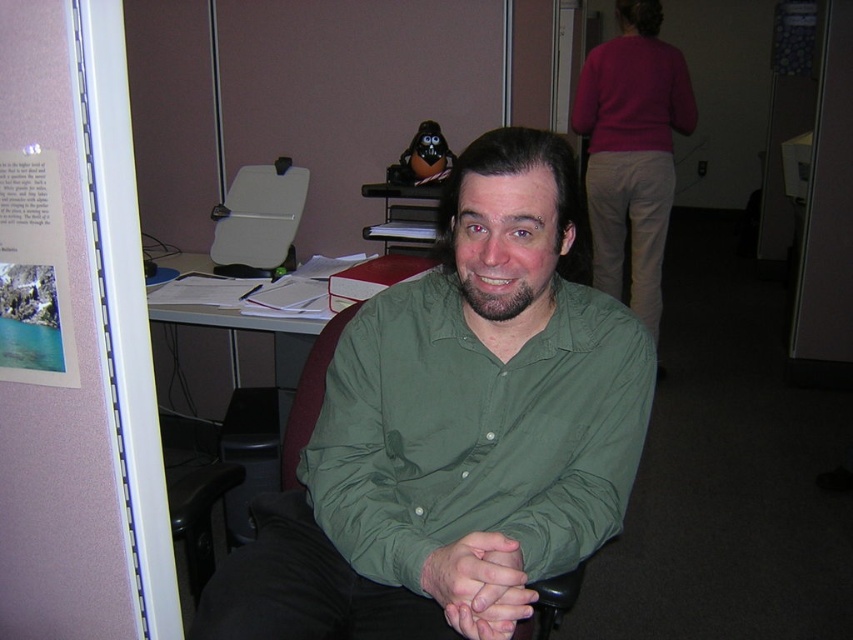
You are an office worker who needs to place a new document organizer on your desk. You have two items on your desk labeled as green matte hands at center and green fabric chair at center. Which item takes up more desk space?

The green fabric chair at center takes up more desk space than the green matte hands at center because the green matte hands at center occupies less space than green fabric chair at center.

You are a delivery person entering an office and see the green matte dress shirt at center and the green fabric chair at center. Which object is closer to you?

The green matte dress shirt at center is closer to you because the green fabric chair at center is behind it.